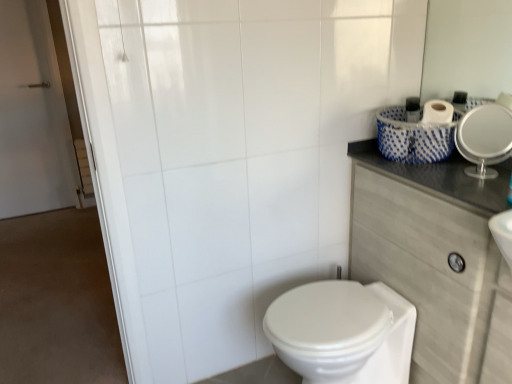
Question: Should I look upward or downward to see white glossy bidet at lower center?

Choices:
 (A) down
 (B) up

Answer: (A)

Question: Are dark gray laminate counter top at upper right and white glossy mirror at upper right making contact?

Choices:
 (A) yes
 (B) no

Answer: (B)

Question: Is there a large distance between dark gray laminate counter top at upper right and white glossy mirror at upper right?

Choices:
 (A) no
 (B) yes

Answer: (A)

Question: Does dark gray laminate counter top at upper right have a lesser height compared to white glossy mirror at upper right?

Choices:
 (A) no
 (B) yes

Answer: (A)

Question: From a real-world perspective, is dark gray laminate counter top at upper right below white glossy mirror at upper right?

Choices:
 (A) no
 (B) yes

Answer: (B)

Question: Does dark gray laminate counter top at upper right have a greater height compared to white glossy mirror at upper right?

Choices:
 (A) yes
 (B) no

Answer: (A)

Question: Is dark gray laminate counter top at upper right behind white glossy mirror at upper right?

Choices:
 (A) yes
 (B) no

Answer: (B)

Question: From the image's perspective, is white glossy mirror at upper right over white glossy bidet at lower center?

Choices:
 (A) no
 (B) yes

Answer: (B)

Question: Can you confirm if white glossy mirror at upper right is wider than white glossy bidet at lower center?

Choices:
 (A) no
 (B) yes

Answer: (A)

Question: Can you confirm if white glossy mirror at upper right is bigger than white glossy bidet at lower center?

Choices:
 (A) no
 (B) yes

Answer: (A)

Question: Can you confirm if white glossy mirror at upper right is smaller than white glossy bidet at lower center?

Choices:
 (A) no
 (B) yes

Answer: (B)

Question: Is the surface of white glossy mirror at upper right in direct contact with white glossy bidet at lower center?

Choices:
 (A) yes
 (B) no

Answer: (B)

Question: Is white glossy mirror at upper right behind white glossy bidet at lower center?

Choices:
 (A) yes
 (B) no

Answer: (A)

Question: Are white glossy bidet at lower center and white glossy mirror at upper right far apart?

Choices:
 (A) no
 (B) yes

Answer: (A)